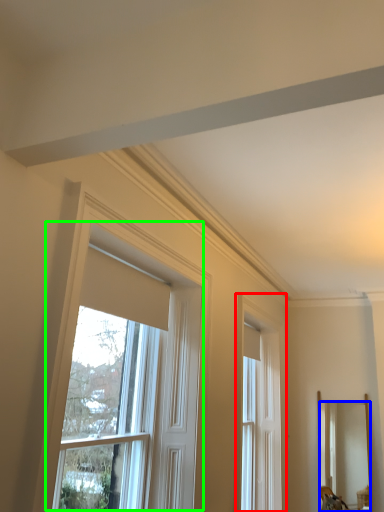
Question: Which object is positioned farthest from window (highlighted by a red box)? Select from mirror (highlighted by a blue box) and window (highlighted by a green box).

Choices:
 (A) mirror
 (B) window

Answer: (B)